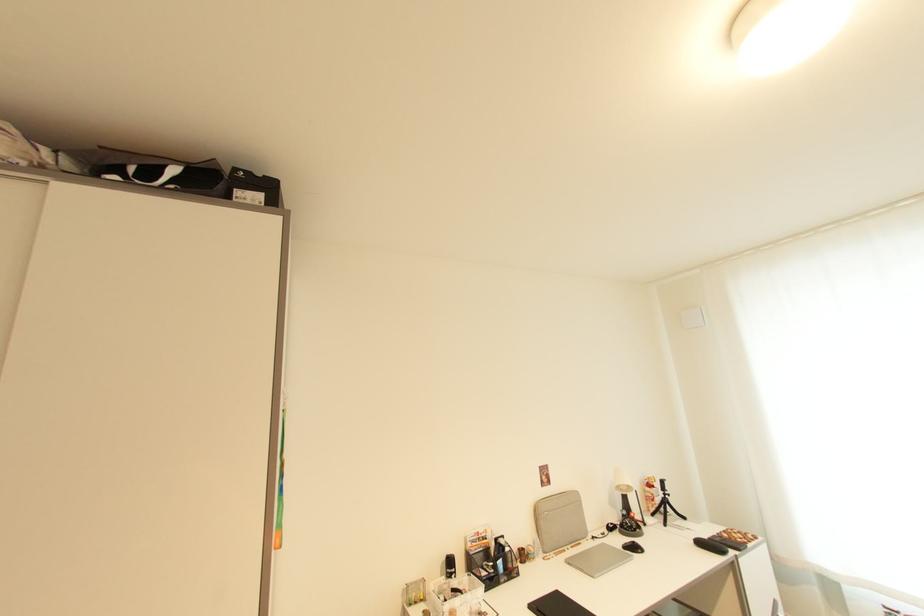
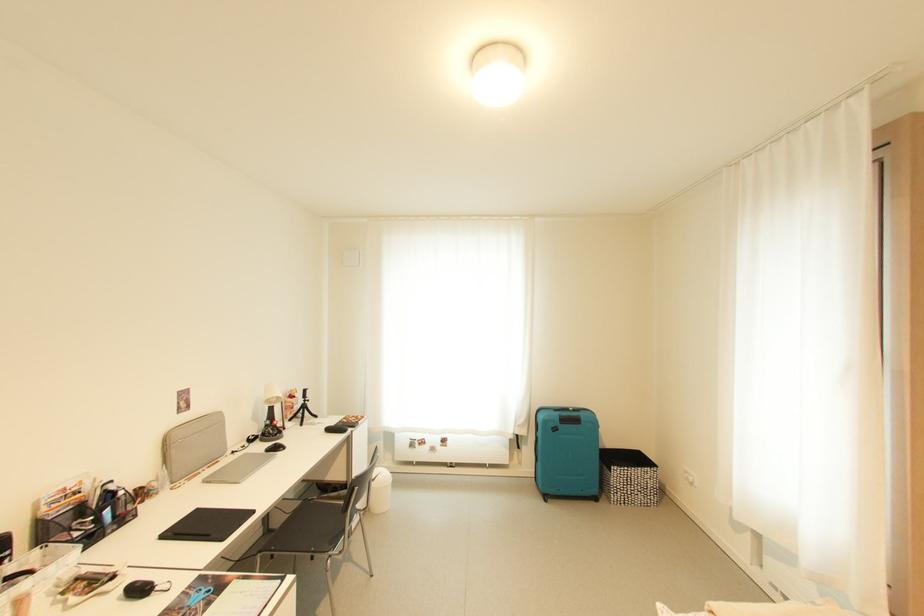
Where in the second image is the point corresponding to (x=546, y=525) from the first image?

(177, 455)